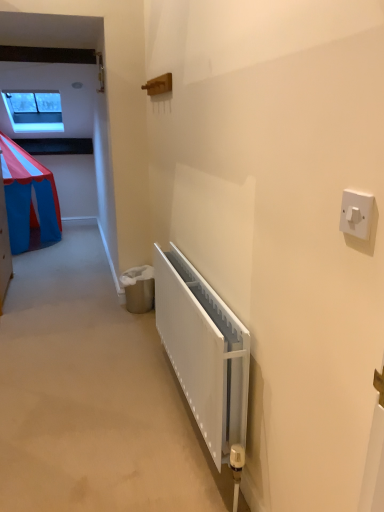
The width and height of the screenshot is (384, 512). Describe the element at coordinates (203, 351) in the screenshot. I see `white matte radiator at lower center` at that location.

The width and height of the screenshot is (384, 512). Find the location of `white plastic light switch at upper right`. white plastic light switch at upper right is located at coordinates (356, 214).

Is white plastic light switch at upper right facing towards transparent glass window at upper left?

No, white plastic light switch at upper right is not facing towards transparent glass window at upper left.

In the image, is white plastic light switch at upper right on the left side or the right side of transparent glass window at upper left?

white plastic light switch at upper right is positioned on transparent glass window at upper left's right side.

The image size is (384, 512). I want to click on light switch below the transparent glass window at upper left (from a real-world perspective), so click(x=356, y=214).

Can you see white plastic light switch at upper right touching transparent glass window at upper left?

white plastic light switch at upper right and transparent glass window at upper left are clearly separated.

Which of these two, white matte radiator at lower center or transparent glass window at upper left, is thinner?

Thinner between the two is white matte radiator at lower center.

From a real-world perspective, which is physically above, white matte radiator at lower center or transparent glass window at upper left?

In real-world perspective, transparent glass window at upper left is above.

From the image's perspective, is white matte radiator at lower center positioned above or below transparent glass window at upper left?

white matte radiator at lower center is below transparent glass window at upper left.

Considering the sizes of objects white matte radiator at lower center and transparent glass window at upper left in the image provided, who is shorter, white matte radiator at lower center or transparent glass window at upper left?

Standing shorter between the two is white matte radiator at lower center.

Looking at this image, who is shorter, transparent glass window at upper left or white plastic light switch at upper right?

white plastic light switch at upper right.

Is transparent glass window at upper left positioned with its back to white plastic light switch at upper right?

No, transparent glass window at upper left is not facing away from white plastic light switch at upper right.

Is transparent glass window at upper left at the right side of white plastic light switch at upper right?

No.

From the image's perspective, does transparent glass window at upper left appear lower than white plastic light switch at upper right?

Actually, transparent glass window at upper left appears above white plastic light switch at upper right in the image.

Can you tell me how much transparent glass window at upper left and white matte radiator at lower center differ in facing direction?

They differ by 90 degrees in their facing directions.

Is transparent glass window at upper left in front of white matte radiator at lower center?

No, transparent glass window at upper left is behind white matte radiator at lower center.

Would you say transparent glass window at upper left is to the left or to the right of white matte radiator at lower center in the picture?

Based on their positions, transparent glass window at upper left is located to the left of white matte radiator at lower center.

Does point (61, 114) lie in front of point (207, 330)?

No.

Would you say white plastic light switch at upper right is a long distance from white matte radiator at lower center?

No, white plastic light switch at upper right is not far away from white matte radiator at lower center.

Looking at this image, considering the sizes of white plastic light switch at upper right and white matte radiator at lower center in the image, is white plastic light switch at upper right bigger or smaller than white matte radiator at lower center?

white plastic light switch at upper right is smaller than white matte radiator at lower center.

Considering the relative sizes of white plastic light switch at upper right and white matte radiator at lower center in the image provided, is white plastic light switch at upper right wider than white matte radiator at lower center?

No, white plastic light switch at upper right is not wider than white matte radiator at lower center.

From the image's perspective, is white matte radiator at lower center located beneath white plastic light switch at upper right?

Yes, from the image's perspective, white matte radiator at lower center is below white plastic light switch at upper right.

Which of these two, white matte radiator at lower center or white plastic light switch at upper right, is wider?

Wider between the two is white matte radiator at lower center.

Image resolution: width=384 pixels, height=512 pixels. Identify the location of radiator below the white plastic light switch at upper right (from the image's perspective). (203, 351).

Considering the relative sizes of white matte radiator at lower center and white plastic light switch at upper right in the image provided, is white matte radiator at lower center bigger than white plastic light switch at upper right?

Yes.

Where is `window on the left of white plastic light switch at upper right`? The height and width of the screenshot is (512, 384). window on the left of white plastic light switch at upper right is located at coordinates (34, 111).

I want to click on window positioned vertically above the white matte radiator at lower center (from a real-world perspective), so click(x=34, y=111).

Considering their positions, is transparent glass window at upper left positioned closer to white matte radiator at lower center than white plastic light switch at upper right?

The object closer to white matte radiator at lower center is white plastic light switch at upper right.

From the image, which object appears to be farther from white plastic light switch at upper right, transparent glass window at upper left or white matte radiator at lower center?

transparent glass window at upper left.

Which object lies nearer to the anchor point white plastic light switch at upper right, white matte radiator at lower center or transparent glass window at upper left?

Based on the image, white matte radiator at lower center appears to be nearer to white plastic light switch at upper right.

Based on the photo, considering their positions, is white plastic light switch at upper right positioned closer to transparent glass window at upper left than white matte radiator at lower center?

white matte radiator at lower center.

Based on their spatial positions, is white plastic light switch at upper right or transparent glass window at upper left further from white matte radiator at lower center?

Among the two, transparent glass window at upper left is located further to white matte radiator at lower center.

When comparing their distances from transparent glass window at upper left, does white matte radiator at lower center or white plastic light switch at upper right seem further?

The object further to transparent glass window at upper left is white plastic light switch at upper right.

Find the location of a particular element. The width and height of the screenshot is (384, 512). radiator positioned between white plastic light switch at upper right and transparent glass window at upper left from near to far is located at coordinates (203, 351).